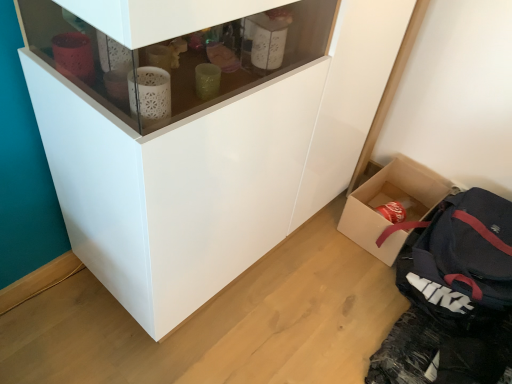
In order to face dark blue fabric backpack at lower right, should I rotate leftwards or rightwards?

Turn right by 27.079 degrees to look at dark blue fabric backpack at lower right.

Measure the distance between point (x=415, y=179) and camera.

Point (x=415, y=179) and camera are 5.77 feet apart.

What do you see at coordinates (390, 201) in the screenshot? I see `cardboard box at lower right` at bounding box center [390, 201].

Where is `dark blue fabric backpack at lower right`? The image size is (512, 384). dark blue fabric backpack at lower right is located at coordinates (459, 260).

Is dark blue fabric backpack at lower right surrounded by white glossy cupboard at center?

No, dark blue fabric backpack at lower right is not inside white glossy cupboard at center.

How different are the orientations of white glossy cupboard at center and dark blue fabric backpack at lower right in degrees?

There is a 85.8-degree angle between the facing directions of white glossy cupboard at center and dark blue fabric backpack at lower right.

Which object is thinner, white glossy cupboard at center or dark blue fabric backpack at lower right?

With smaller width is white glossy cupboard at center.

Which object is more forward, white glossy cupboard at center or dark blue fabric backpack at lower right?

Positioned in front is white glossy cupboard at center.

Is cardboard box at lower right with white glossy cupboard at center?

No, cardboard box at lower right is not beside white glossy cupboard at center.

Is cardboard box at lower right in front of white glossy cupboard at center?

That is False.

Do you think cardboard box at lower right is within white glossy cupboard at center, or outside of it?

cardboard box at lower right exists outside the volume of white glossy cupboard at center.

In order to click on box on the right of white glossy cupboard at center in this screenshot , I will do (390, 201).

At what (x,y) coordinates should I click in order to perform the action: click on backpack that appears in front of the cardboard box at lower right. Please return your answer as a coordinate pair (x, y). This screenshot has height=384, width=512. Looking at the image, I should click on (459, 260).

From a real-world perspective, relative to dark blue fabric backpack at lower right, is cardboard box at lower right vertically above or below?

Clearly, from a real-world perspective, cardboard box at lower right is below dark blue fabric backpack at lower right.

Would you say cardboard box at lower right is a long distance from dark blue fabric backpack at lower right?

No, cardboard box at lower right is not far away from dark blue fabric backpack at lower right.

Looking at this image, from a real-world perspective, between dark blue fabric backpack at lower right and cardboard box at lower right, who is vertically higher?

dark blue fabric backpack at lower right is physically above.

Considering the sizes of objects dark blue fabric backpack at lower right and cardboard box at lower right in the image provided, who is smaller, dark blue fabric backpack at lower right or cardboard box at lower right?

With smaller size is cardboard box at lower right.

Which is in front, dark blue fabric backpack at lower right or cardboard box at lower right?

dark blue fabric backpack at lower right is in front.

Can you confirm if dark blue fabric backpack at lower right is thinner than white glossy cupboard at center?

Incorrect, the width of dark blue fabric backpack at lower right is not less than that of white glossy cupboard at center.

Which object is positioned more to the left, dark blue fabric backpack at lower right or white glossy cupboard at center?

white glossy cupboard at center.

From the image's perspective, between dark blue fabric backpack at lower right and white glossy cupboard at center, which one is located above?

white glossy cupboard at center, from the image's perspective.

Is white glossy cupboard at center wider or thinner than cardboard box at lower right?

Considering their sizes, white glossy cupboard at center looks broader than cardboard box at lower right.

Looking at this image, from the image's perspective, which one is positioned higher, white glossy cupboard at center or cardboard box at lower right?

white glossy cupboard at center is shown above in the image.

What's the angular difference between white glossy cupboard at center and cardboard box at lower right's facing directions?

The angular difference between white glossy cupboard at center and cardboard box at lower right is 88.4 degrees.

Is white glossy cupboard at center not within cardboard box at lower right?

→ Yes, white glossy cupboard at center is not within cardboard box at lower right.

I want to click on backpack below the white glossy cupboard at center (from the image's perspective), so click(459, 260).

Image resolution: width=512 pixels, height=384 pixels. I want to click on cupboard lying above the cardboard box at lower right (from the image's perspective), so click(212, 168).

Considering their positions, is dark blue fabric backpack at lower right positioned closer to cardboard box at lower right than white glossy cupboard at center?

dark blue fabric backpack at lower right is closer to cardboard box at lower right.

Looking at the image, which one is located further to dark blue fabric backpack at lower right, white glossy cupboard at center or cardboard box at lower right?

Among the two, white glossy cupboard at center is located further to dark blue fabric backpack at lower right.

When comparing their distances from white glossy cupboard at center, does cardboard box at lower right or dark blue fabric backpack at lower right seem further?

cardboard box at lower right is positioned further to the anchor white glossy cupboard at center.

Estimate the real-world distances between objects in this image. Which object is closer to dark blue fabric backpack at lower right, cardboard box at lower right or white glossy cupboard at center?

Among the two, cardboard box at lower right is located nearer to dark blue fabric backpack at lower right.

Based on their spatial positions, is white glossy cupboard at center or dark blue fabric backpack at lower right further from cardboard box at lower right?

Among the two, white glossy cupboard at center is located further to cardboard box at lower right.

Which object lies nearer to the anchor point white glossy cupboard at center, dark blue fabric backpack at lower right or cardboard box at lower right?

dark blue fabric backpack at lower right is positioned closer to the anchor white glossy cupboard at center.

Where is `backpack located between white glossy cupboard at center and cardboard box at lower right in the depth direction`? backpack located between white glossy cupboard at center and cardboard box at lower right in the depth direction is located at coordinates (459, 260).